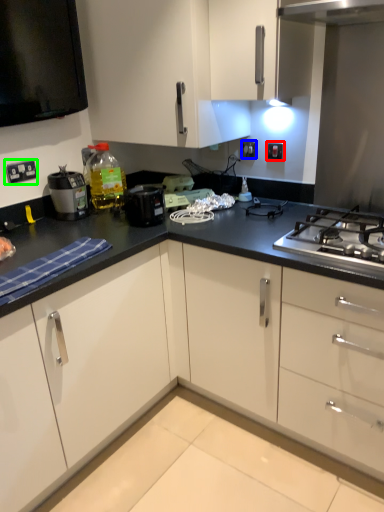
Question: Based on their relative distances, which object is nearer to electric outlet (highlighted by a red box)? Choose from electric outlet (highlighted by a blue box) and electric outlet (highlighted by a green box).

Choices:
 (A) electric outlet
 (B) electric outlet

Answer: (A)